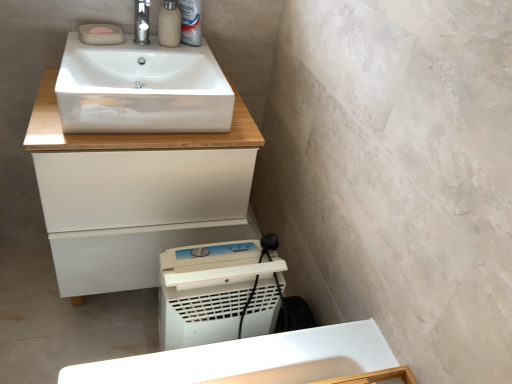
Question: Is white glossy sink at upper center at the right side of matte beige soap dispenser at upper center?

Choices:
 (A) yes
 (B) no

Answer: (B)

Question: Considering the relative sizes of white glossy sink at upper center and matte beige soap dispenser at upper center in the image provided, is white glossy sink at upper center wider than matte beige soap dispenser at upper center?

Choices:
 (A) yes
 (B) no

Answer: (A)

Question: Is matte beige soap dispenser at upper center at the back of white glossy sink at upper center?

Choices:
 (A) no
 (B) yes

Answer: (B)

Question: From the image's perspective, is white glossy sink at upper center located beneath matte beige soap dispenser at upper center?

Choices:
 (A) yes
 (B) no

Answer: (A)

Question: Is white glossy sink at upper center oriented towards matte beige soap dispenser at upper center?

Choices:
 (A) no
 (B) yes

Answer: (A)

Question: Is the position of white glossy sink at upper center less distant than that of matte beige soap dispenser at upper center?

Choices:
 (A) no
 (B) yes

Answer: (B)

Question: Can you confirm if polished chrome tap at upper center is taller than white glossy sink at upper center?

Choices:
 (A) yes
 (B) no

Answer: (B)

Question: Is polished chrome tap at upper center thinner than white glossy sink at upper center?

Choices:
 (A) no
 (B) yes

Answer: (B)

Question: Can we say polished chrome tap at upper center lies outside white glossy sink at upper center?

Choices:
 (A) no
 (B) yes

Answer: (A)

Question: Is polished chrome tap at upper center not near white glossy sink at upper center?

Choices:
 (A) no
 (B) yes

Answer: (A)

Question: Is polished chrome tap at upper center at the right side of white glossy sink at upper center?

Choices:
 (A) yes
 (B) no

Answer: (B)

Question: Considering the relative sizes of polished chrome tap at upper center and white glossy sink at upper center in the image provided, is polished chrome tap at upper center bigger than white glossy sink at upper center?

Choices:
 (A) no
 (B) yes

Answer: (A)

Question: Does matte beige soap dispenser at upper center have a greater width compared to white plastic can at upper center?

Choices:
 (A) yes
 (B) no

Answer: (A)